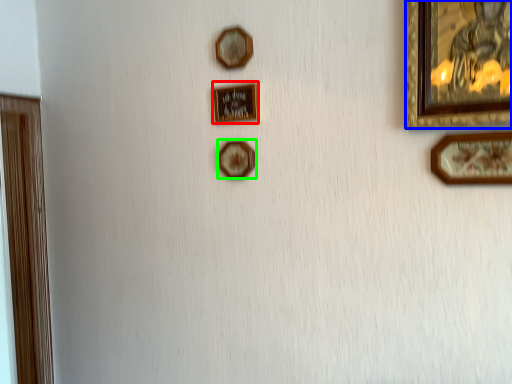
Question: Considering the real-world distances, which object is farthest from picture frame (highlighted by a red box)? picture frame (highlighted by a blue box) or picture frame (highlighted by a green box)?

Choices:
 (A) picture frame
 (B) picture frame

Answer: (A)